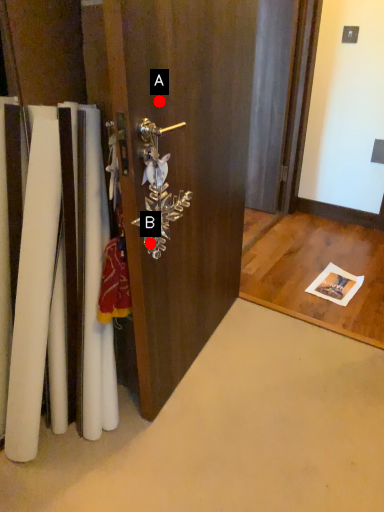
Question: Two points are circled on the image, labeled by A and B beside each circle. Which point is closer to the camera?

Choices:
 (A) A is closer
 (B) B is closer

Answer: (A)